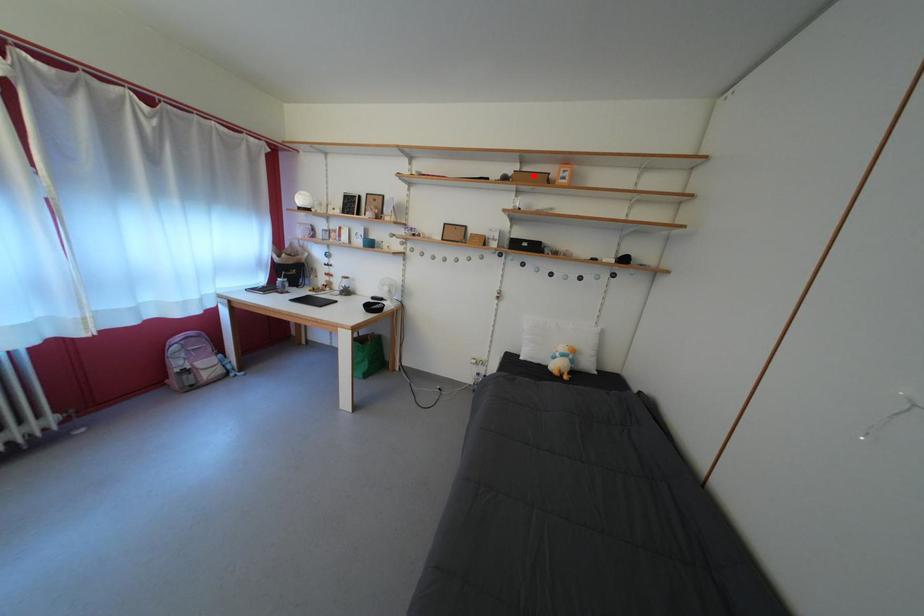
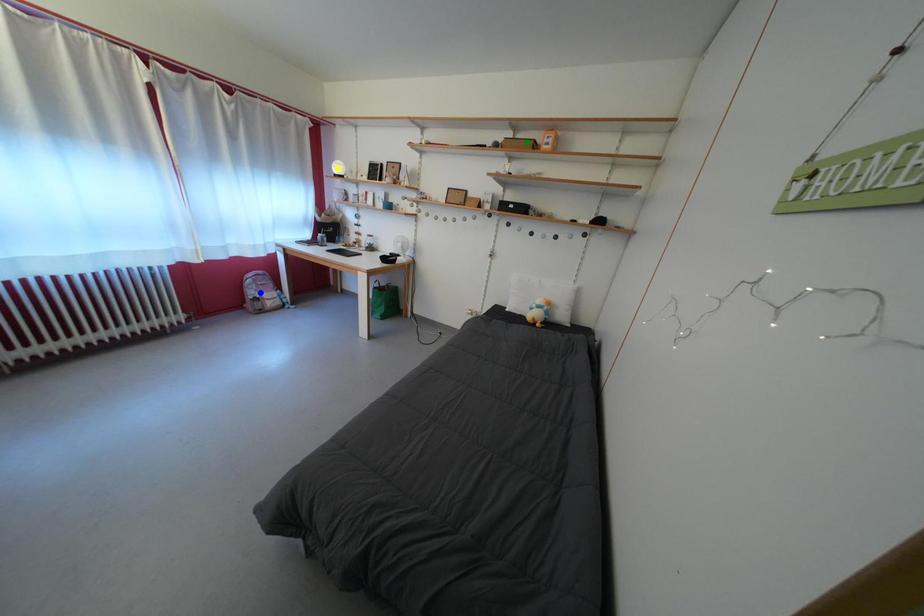
Question: I am providing you with two images of the same scene from different viewpoints. A red point is marked on the first image. You are given multiple points on the second image. In image 2, which mark is for the same physical point as the one in image 1?

Choices:
 (A) green point
 (B) blue point
 (C) yellow point

Answer: (A)